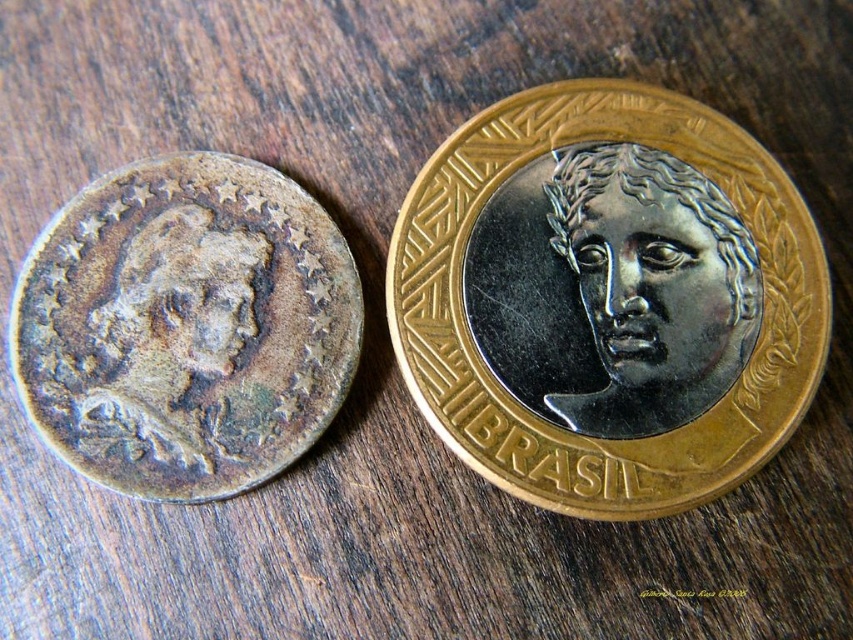
You are looking at a wooden surface with two coins. The older silver coin on the left has a worn texture and a circular design with stars around the edge. The newer gold coin on the right has a modern design with the word BRASIL. There is a point marked at coordinates (607, 298). Which coin does this point correspond to?

The point at coordinates (607, 298) corresponds to the gold coin at the center, as stated in the objects description.

You are standing in front of a wooden table with two coins. You need to pick up the coin that is closer to you. Which one should you choose between the point at (616, 369) and the point at (338, 394)?

You should pick up the point at (616, 369) because it is closer to the viewer than the point at (338, 394).